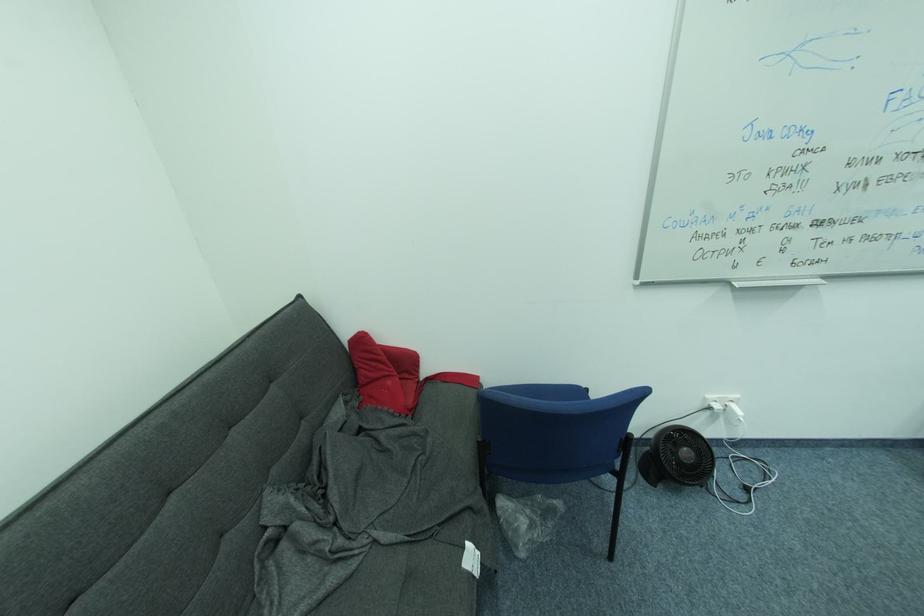
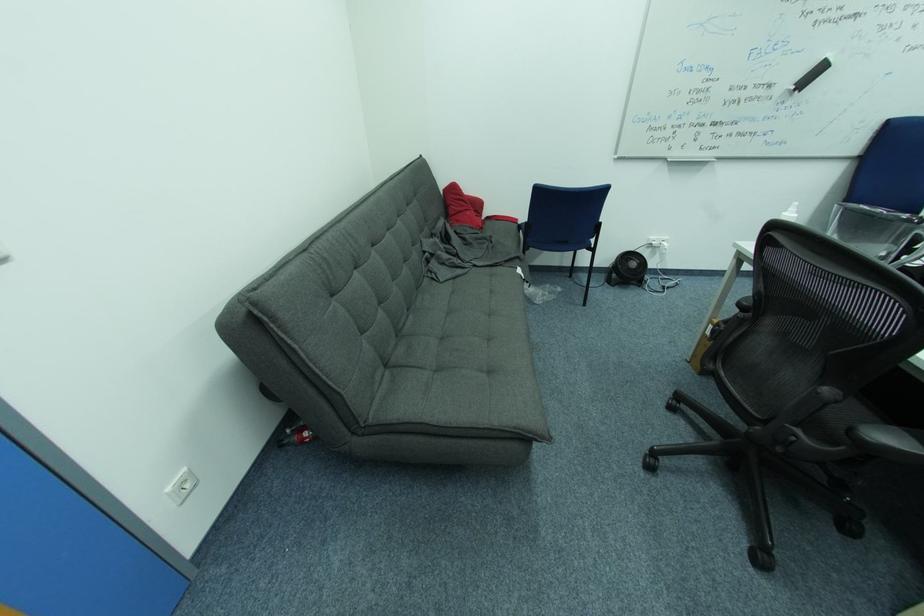
Find the pixel in the second image that matches (x=370, y=341) in the first image.

(459, 188)